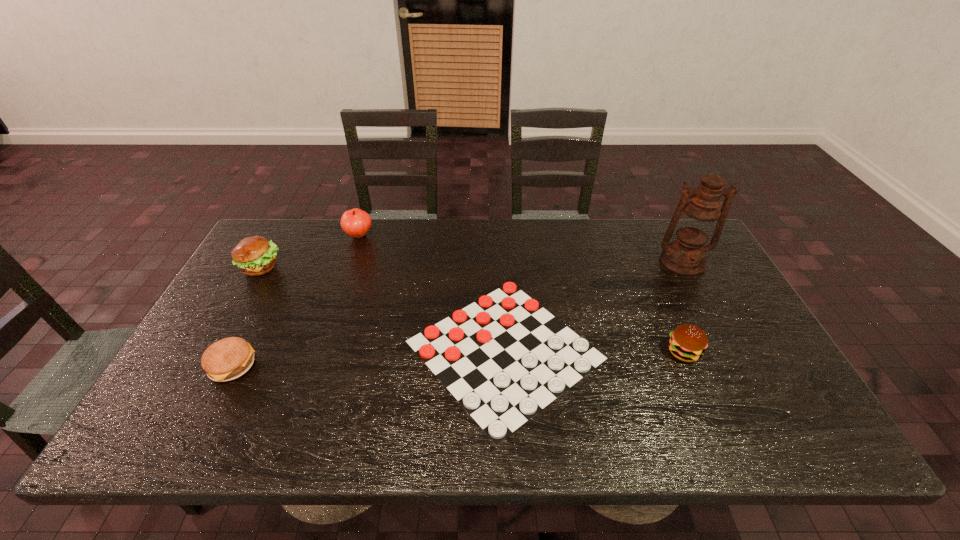
Locate an element on the screen. This screenshot has height=540, width=960. vacant region located on the left of the third object from left to right is located at coordinates (x=276, y=235).

This screenshot has width=960, height=540. Identify the location of vacant region located on the right of the tallest hamburger. (313, 267).

You are a GUI agent. You are given a task and a screenshot of the screen. Output one action in this format:
    pyautogui.click(x=<x>, y=<y>)
    Task: Click on the vacant space located on the back of the second tallest hamburger
    This screenshot has width=960, height=540.
    Given the screenshot: What is the action you would take?
    pyautogui.click(x=667, y=313)

Identify the location of vacant space located on the back of the shortest hamburger. (275, 282).

Image resolution: width=960 pixels, height=540 pixels. Find the location of `vacant space located 0.100m on the right of the checkerboard`. vacant space located 0.100m on the right of the checkerboard is located at coordinates [644, 349].

You are a GUI agent. You are given a task and a screenshot of the screen. Output one action in this format:
    pyautogui.click(x=<x>, y=<y>)
    Task: Click on the oil lamp that is at the far edge
    The width and height of the screenshot is (960, 540).
    Given the screenshot: What is the action you would take?
    pyautogui.click(x=696, y=220)

Identify the location of apple situated at the far edge. (355, 222).

Where is `hamburger positioned at the far edge`? hamburger positioned at the far edge is located at coordinates 255,255.

You are a GUI agent. You are given a task and a screenshot of the screen. Output one action in this format:
    pyautogui.click(x=<x>, y=<y>)
    Task: Click on the object that is at the near edge
    
    Given the screenshot: What is the action you would take?
    pyautogui.click(x=504, y=357)

The height and width of the screenshot is (540, 960). In order to click on object that is at the right edge in this screenshot , I will do `click(696, 220)`.